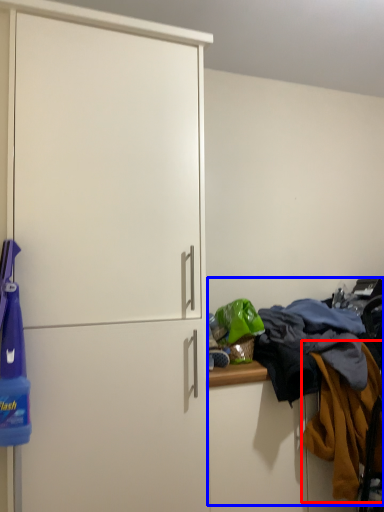
Question: Among these objects, which one is farthest to the camera, clothing (highlighted by a red box) or laundry (highlighted by a blue box)?

Choices:
 (A) clothing
 (B) laundry

Answer: (B)